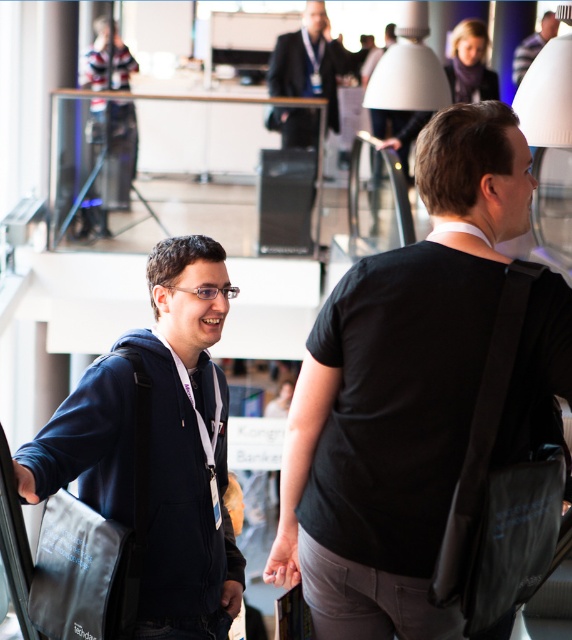
Question: Which object is positioned farthest from the dark suit at upper center?

Choices:
 (A) matte black backpack at upper right
 (B) black matte bag at center
 (C) dark blue hoodie at center

Answer: (B)

Question: Which point appears closest to the camera in this image?

Choices:
 (A) (275, 90)
 (B) (415, 584)
 (C) (188, 321)
 (D) (550, 28)

Answer: (B)

Question: Is dark suit at upper center thinner than matte black backpack at upper right?

Choices:
 (A) yes
 (B) no

Answer: (A)

Question: Is black matte bag at center behind matte black backpack at upper right?

Choices:
 (A) yes
 (B) no

Answer: (B)

Question: Does black matte bag at center come in front of dark suit at upper center?

Choices:
 (A) no
 (B) yes

Answer: (B)

Question: Among these objects, which one is nearest to the camera?

Choices:
 (A) matte black backpack at upper right
 (B) dark blue hoodie at center
 (C) black matte bag at center

Answer: (C)